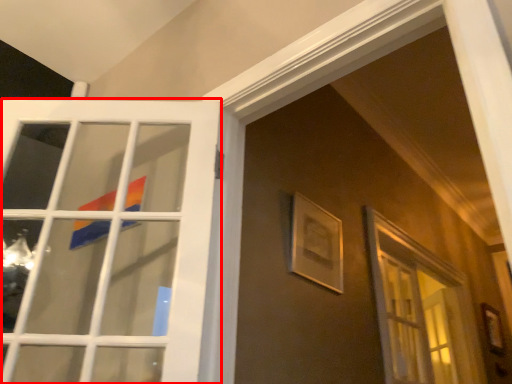
Question: In this image, where is door (annotated by the red box) located relative to picture frame?

Choices:
 (A) right
 (B) left

Answer: (B)